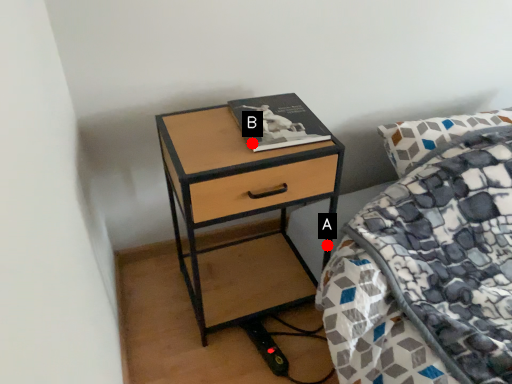
Question: Two points are circled on the image, labeled by A and B beside each circle. Which point is closer to the camera?

Choices:
 (A) A is closer
 (B) B is closer

Answer: (B)